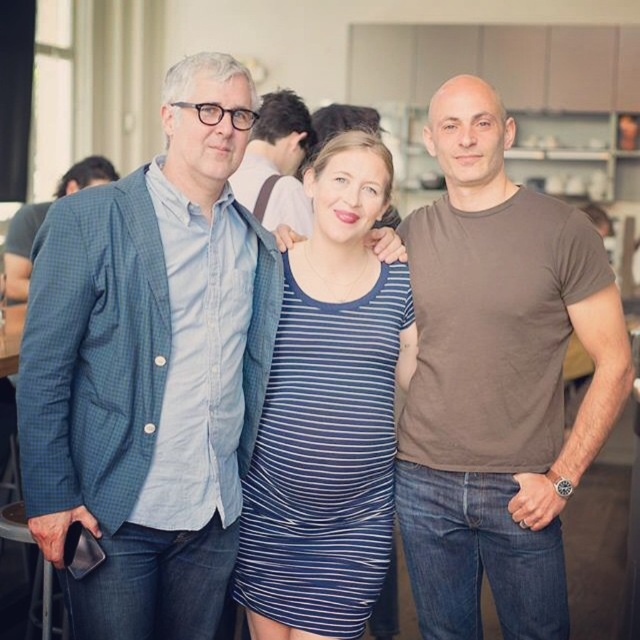
Question: Can you confirm if blue checkered blazer at center is smaller than brown cotton t-shirt at right?

Choices:
 (A) no
 (B) yes

Answer: (A)

Question: Observing the image, what is the correct spatial positioning of blue checkered blazer at center in reference to matte blue shirt at center?

Choices:
 (A) above
 (B) below

Answer: (B)

Question: Can you confirm if blue checkered blazer at center is positioned to the right of matte blue shirt at center?

Choices:
 (A) yes
 (B) no

Answer: (B)

Question: Among these objects, which one is farthest from the camera?

Choices:
 (A) blue striped dress at center
 (B) matte blue shirt at center

Answer: (B)

Question: Estimate the real-world distances between objects in this image. Which object is farther from the brown cotton t-shirt at right?

Choices:
 (A) matte blue shirt at center
 (B) blue striped dress at center
 (C) blue checkered blazer at center

Answer: (A)

Question: Considering the real-world distances, which object is closest to the brown cotton t-shirt at right?

Choices:
 (A) matte blue shirt at center
 (B) blue checkered blazer at center
 (C) blue striped dress at center

Answer: (C)